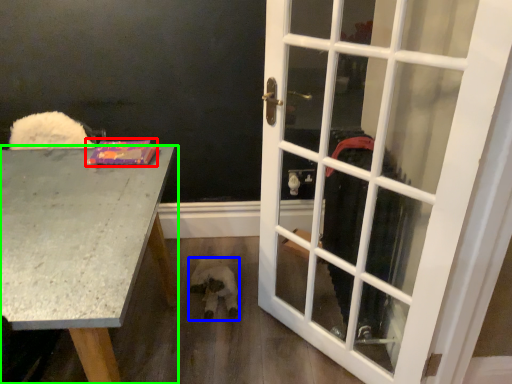
Question: Which is nearer to the book (highlighted by a red box)? animal (highlighted by a blue box) or desk (highlighted by a green box).

Choices:
 (A) animal
 (B) desk

Answer: (B)